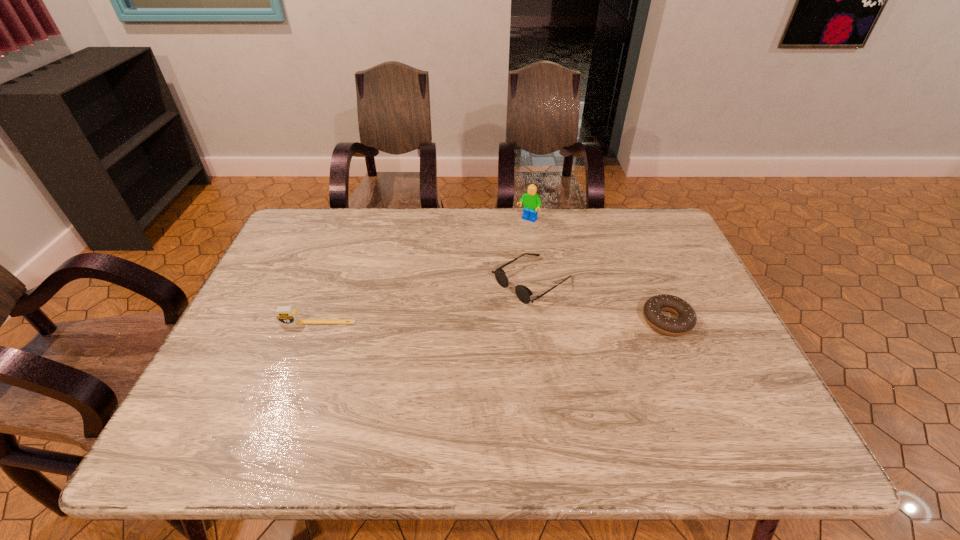
The width and height of the screenshot is (960, 540). Find the location of `vacant area at the far left corner`. vacant area at the far left corner is located at coordinates (328, 213).

Where is `vacant space at the far right corner`? The image size is (960, 540). vacant space at the far right corner is located at coordinates (654, 243).

This screenshot has width=960, height=540. I want to click on vacant space that is in between the tallest object and the sunglasses, so click(x=530, y=251).

Locate an element on the screen. vacant area between the sunglasses and the rightmost object is located at coordinates (599, 301).

This screenshot has width=960, height=540. Find the location of `free area in between the leftmost object and the sunglasses`. free area in between the leftmost object and the sunglasses is located at coordinates 424,302.

Identify the location of unoccupied position between the tallest object and the doughnut. (597, 271).

Where is `blank region between the sunglasses and the tallest object`? blank region between the sunglasses and the tallest object is located at coordinates (530, 251).

Where is `vacant area that lies between the Lego and the sunglasses`? The width and height of the screenshot is (960, 540). vacant area that lies between the Lego and the sunglasses is located at coordinates (530, 251).

Locate an element on the screen. Image resolution: width=960 pixels, height=540 pixels. vacant area that lies between the sunglasses and the doughnut is located at coordinates (599, 301).

Where is `vacant space in between the sunglasses and the doughnut`? Image resolution: width=960 pixels, height=540 pixels. vacant space in between the sunglasses and the doughnut is located at coordinates (599, 301).